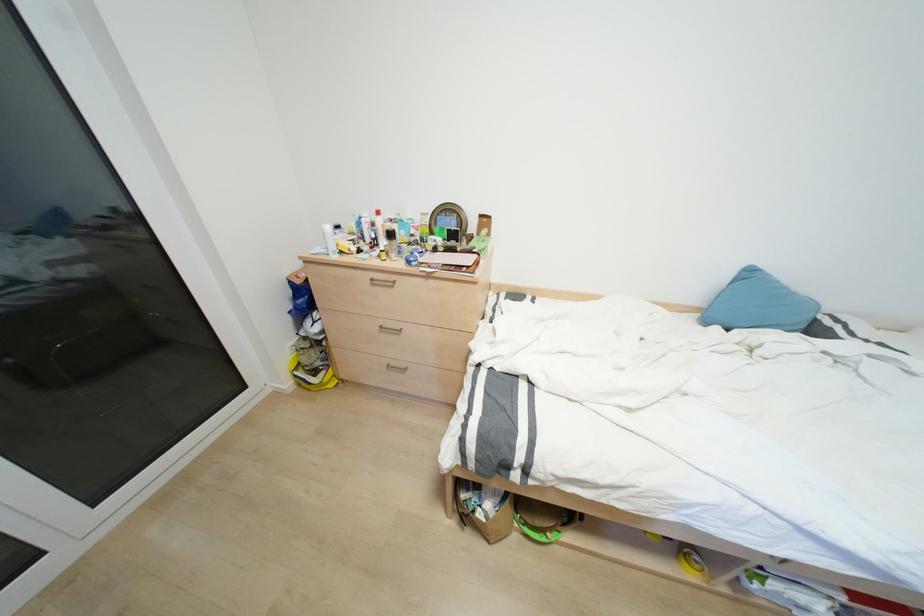
The height and width of the screenshot is (616, 924). I want to click on black spray can, so click(x=391, y=241).